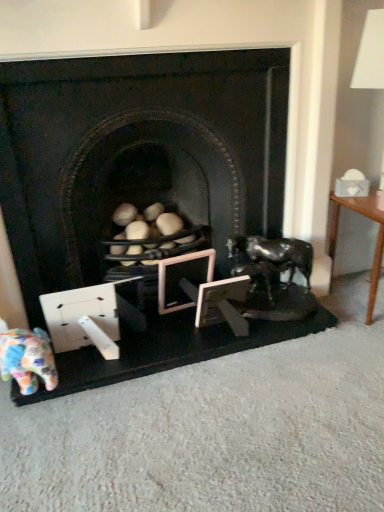
Measure the distance between point (24,391) and camera.

1.31 meters.

The width and height of the screenshot is (384, 512). Describe the element at coordinates (222, 304) in the screenshot. I see `wooden picture frame at center, acting as the 2th picture frame starting from the left` at that location.

This screenshot has height=512, width=384. In order to click on multicolored fabric elephant at lower left in this screenshot , I will do `click(27, 358)`.

Based on the photo, in terms of width, does wooden picture frame at center, acting as the 2th picture frame starting from the left, look wider or thinner when compared to wooden table at right?

Clearly, wooden picture frame at center, acting as the 2th picture frame starting from the left, has less width compared to wooden table at right.

Would you say wooden picture frame at center, arranged as the first picture frame when viewed from the right, is outside wooden table at right?

wooden picture frame at center, arranged as the first picture frame when viewed from the right, is positioned outside wooden table at right.

This screenshot has height=512, width=384. Find the location of `the 2nd picture frame below the wooden table at right (from the image's perspective)`. the 2nd picture frame below the wooden table at right (from the image's perspective) is located at coordinates pos(222,304).

Based on the photo, does wooden picture frame at center, arranged as the first picture frame when viewed from the right, appear on the right side of wooden table at right?

In fact, wooden picture frame at center, arranged as the first picture frame when viewed from the right, is to the left of wooden table at right.

Does matte black fireplace at center turn towards wooden picture frame at center, arranged as the first picture frame when viewed from the right?

Yes, matte black fireplace at center is aimed at wooden picture frame at center, arranged as the first picture frame when viewed from the right.

Which object is positioned more to the left, matte black fireplace at center or wooden picture frame at center, acting as the 2th picture frame starting from the left?

matte black fireplace at center.

Considering the relative sizes of matte black fireplace at center and wooden picture frame at center, acting as the 2th picture frame starting from the left, in the image provided, is matte black fireplace at center wider than wooden picture frame at center, acting as the 2th picture frame starting from the left,?

Yes.

Is point (174, 129) positioned behind point (230, 298)?

No, it is not.

Can you confirm if wooden table at right is taller than wooden picture frame at center, the 1th picture frame in the left-to-right sequence?

Indeed, wooden table at right has a greater height compared to wooden picture frame at center, the 1th picture frame in the left-to-right sequence.

From the image's perspective, is wooden table at right below wooden picture frame at center, the 1th picture frame in the left-to-right sequence?

Incorrect, from the image's perspective, wooden table at right is higher than wooden picture frame at center, the 1th picture frame in the left-to-right sequence.

From a real-world perspective, is wooden table at right above or below wooden picture frame at center, marked as the 2th picture frame in a right-to-left arrangement?

wooden table at right is above wooden picture frame at center, marked as the 2th picture frame in a right-to-left arrangement.

Is matte black fireplace at center facing away from shiny black horse at right?

That's right, matte black fireplace at center is facing away from shiny black horse at right.

Does point (3, 94) appear closer or farther from the camera than point (253, 281)?

Point (3, 94) is positioned closer to the camera compared to point (253, 281).

You are a GUI agent. You are given a task and a screenshot of the screen. Output one action in this format:
    pyautogui.click(x=<x>, y=<y>)
    Task: Click on the fireplace located on the left of shiny black horse at right
    
    Given the screenshot: What is the action you would take?
    pyautogui.click(x=129, y=147)

Considering the relative positions of matte black fireplace at center and shiny black horse at right in the image provided, is matte black fireplace at center to the left of shiny black horse at right from the viewer's perspective?

Yes, matte black fireplace at center is to the left of shiny black horse at right.

Considering the sizes of objects matte black fireplace at center and wooden table at right in the image provided, who is thinner, matte black fireplace at center or wooden table at right?

wooden table at right.

Are matte black fireplace at center and wooden table at right located far from each other?

matte black fireplace at center is near wooden table at right, not far away.

Could you tell me if matte black fireplace at center is turned towards wooden table at right?

No, matte black fireplace at center is not oriented towards wooden table at right.

Is shiny black horse at right in contact with wooden table at right?

No, shiny black horse at right is not beside wooden table at right.

This screenshot has width=384, height=512. Find the location of `table above the shiny black horse at right (from the image's perspective)`. table above the shiny black horse at right (from the image's perspective) is located at coordinates (376, 239).

Who is taller, shiny black horse at right or wooden table at right?

Standing taller between the two is wooden table at right.

Which object is closer to the camera, shiny black horse at right or wooden table at right?

wooden table at right.

This screenshot has height=512, width=384. Identify the location of toy below the shiny black horse at right (from the image's perspective). (27, 358).

In the image, is shiny black horse at right positioned in front of or behind multicolored fabric elephant at lower left?

Visually, shiny black horse at right is located behind multicolored fabric elephant at lower left.

Can you tell me how much shiny black horse at right and multicolored fabric elephant at lower left differ in facing direction?

They differ by 36.8 degrees in their facing directions.

This screenshot has height=512, width=384. I want to click on the 2nd picture frame below when counting from the wooden table at right (from the image's perspective), so click(222, 304).

Find the location of a particular element. This screenshot has width=384, height=512. fireplace that is on the left side of wooden picture frame at center, arranged as the first picture frame when viewed from the right is located at coordinates (129, 147).

Which object lies further to the anchor point matte black fireplace at center, wooden table at right or multicolored fabric elephant at lower left?

Among the two, wooden table at right is located further to matte black fireplace at center.

When comparing their distances from wooden picture frame at center, acting as the 2th picture frame starting from the left, does matte black fireplace at center or multicolored fabric elephant at lower left seem closer?

matte black fireplace at center is positioned closer to the anchor wooden picture frame at center, acting as the 2th picture frame starting from the left.

Which object lies nearer to the anchor point wooden picture frame at center, acting as the 2th picture frame starting from the left, multicolored fabric elephant at lower left or wooden picture frame at center, marked as the 2th picture frame in a right-to-left arrangement?

wooden picture frame at center, marked as the 2th picture frame in a right-to-left arrangement.

Based on their spatial positions, is wooden picture frame at center, acting as the 2th picture frame starting from the left, or wooden table at right closer to multicolored fabric elephant at lower left?

wooden picture frame at center, acting as the 2th picture frame starting from the left, is closer to multicolored fabric elephant at lower left.

When comparing their distances from shiny black horse at right, does wooden table at right or matte black fireplace at center seem closer?

wooden table at right is positioned closer to the anchor shiny black horse at right.

When comparing their distances from multicolored fabric elephant at lower left, does wooden table at right or matte black fireplace at center seem further?

wooden table at right lies further to multicolored fabric elephant at lower left than the other object.

When comparing their distances from matte black fireplace at center, does shiny black horse at right or wooden picture frame at center, marked as the 2th picture frame in a right-to-left arrangement, seem further?

wooden picture frame at center, marked as the 2th picture frame in a right-to-left arrangement, is positioned further to the anchor matte black fireplace at center.

When comparing their distances from wooden picture frame at center, marked as the 2th picture frame in a right-to-left arrangement, does multicolored fabric elephant at lower left or wooden table at right seem closer?

multicolored fabric elephant at lower left lies closer to wooden picture frame at center, marked as the 2th picture frame in a right-to-left arrangement, than the other object.

The width and height of the screenshot is (384, 512). I want to click on fireplace between multicolored fabric elephant at lower left and wooden table at right from left to right, so click(129, 147).

At what (x,y) coordinates should I click in order to perform the action: click on animal situated between multicolored fabric elephant at lower left and wooden table at right from left to right. Please return your answer as a coordinate pair (x, y). This screenshot has width=384, height=512. Looking at the image, I should click on (269, 261).

Locate an element on the screen. This screenshot has width=384, height=512. picture frame between multicolored fabric elephant at lower left and wooden picture frame at center, acting as the 2th picture frame starting from the left is located at coordinates (181, 278).

I want to click on animal between matte black fireplace at center and wooden table at right, so click(269, 261).